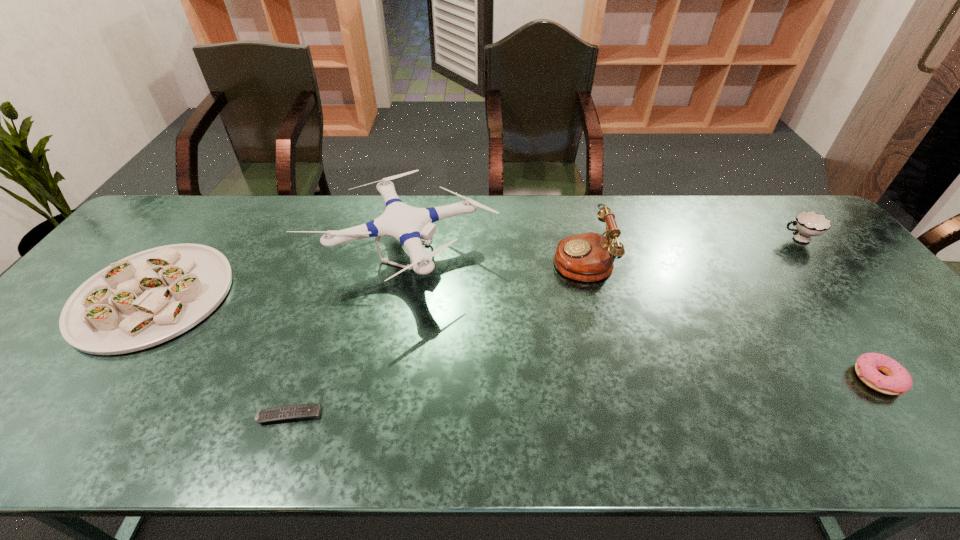
Where is `vacant space located on the dial of the telephone`? vacant space located on the dial of the telephone is located at coordinates (519, 258).

Where is `vacant space located 0.080m on the dial of the telephone`? The height and width of the screenshot is (540, 960). vacant space located 0.080m on the dial of the telephone is located at coordinates (526, 258).

The image size is (960, 540). Identify the location of free space located 0.170m on the left of the drone. (250, 256).

Find the location of `vacant space located 0.280m on the side of the third tallest object with the handle`. vacant space located 0.280m on the side of the third tallest object with the handle is located at coordinates (689, 239).

I want to click on vacant region located on the side of the third tallest object with the handle, so click(x=669, y=239).

Identify the location of free region located on the side of the third tallest object with the handle. The image size is (960, 540). (657, 239).

In order to click on vacant area located on the front of the platter in this screenshot , I will do `click(57, 428)`.

The width and height of the screenshot is (960, 540). In order to click on blank space located 0.260m on the left of the second shortest object in this screenshot , I will do `click(741, 379)`.

Where is `vacant space positioned 0.190m on the right of the nearest object`? This screenshot has width=960, height=540. vacant space positioned 0.190m on the right of the nearest object is located at coordinates (410, 415).

Where is `telephone that is at the far edge`? telephone that is at the far edge is located at coordinates (588, 257).